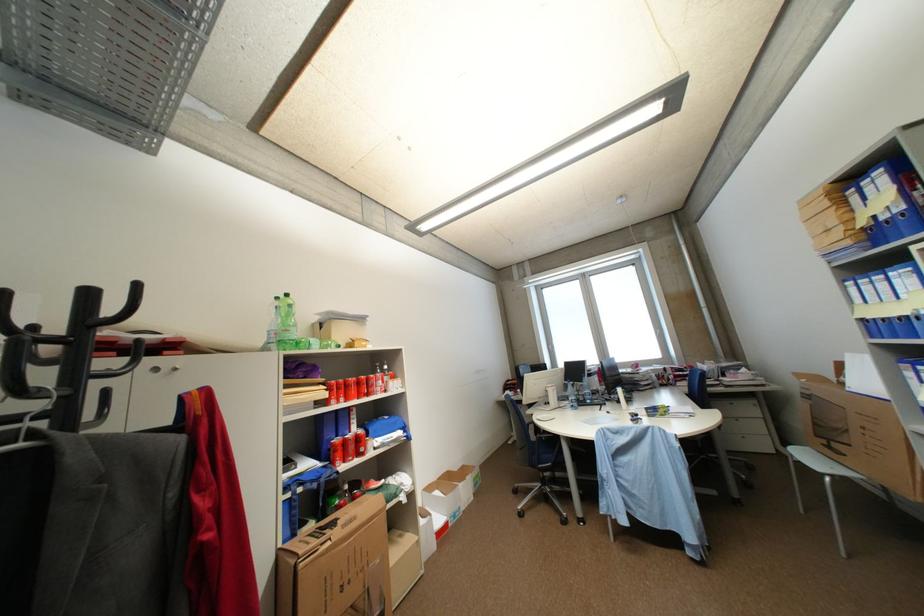
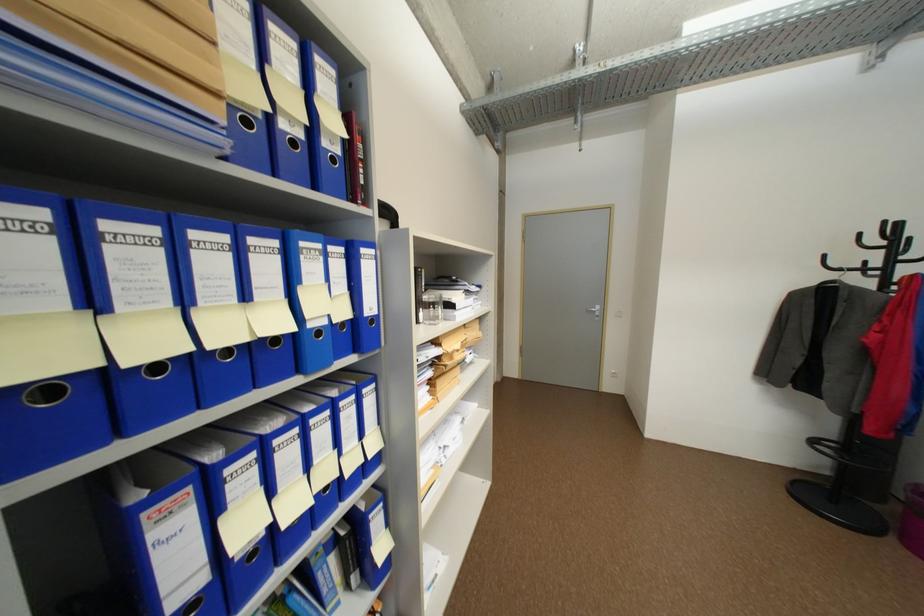
Locate, in the second image, the point that corresponds to pixel 893 321 in the first image.

(164, 368)